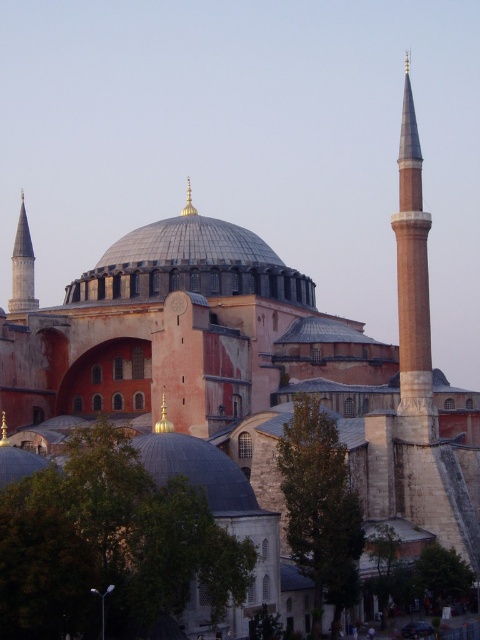
Who is positioned more to the right, smooth stone minaret at left or gold metallic spire at center?

Positioned to the right is gold metallic spire at center.

Describe the element at coordinates (23, 266) in the screenshot. This screenshot has height=640, width=480. I see `smooth stone minaret at left` at that location.

Which is in front, point (24, 266) or point (189, 205)?

Point (24, 266) is more forward.

The image size is (480, 640). Identify the location of smooth stone minaret at left. (23, 266).